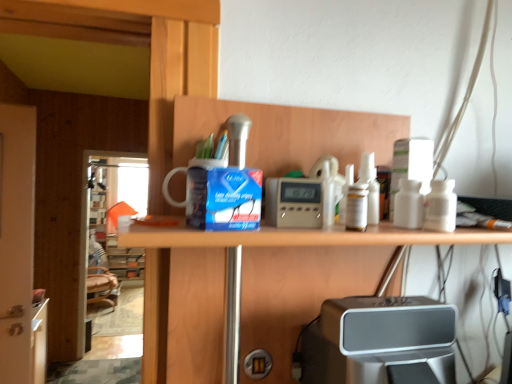
Question: In terms of size, does transparent glass screen door at left, marked as the second screen door in a front-to-back arrangement, appear bigger or smaller than matte digital clock at center?

Choices:
 (A) small
 (B) big

Answer: (B)

Question: Would you say transparent glass screen door at left, marked as the second screen door in a front-to-back arrangement, is inside or outside matte digital clock at center?

Choices:
 (A) outside
 (B) inside

Answer: (A)

Question: Based on their relative distances, which object is farther from the transparent glass screen door at left, the first screen door from the back?

Choices:
 (A) matte digital clock at center
 (B) silver metallic speaker at lower center
 (C) white glossy door at left, marked as the first screen door in a right-to-left arrangement

Answer: (A)

Question: Based on their relative distances, which object is farther from the transparent glass screen door at left, marked as the second screen door in a front-to-back arrangement?

Choices:
 (A) matte digital clock at center
 (B) silver metallic speaker at lower center
 (C) white glossy door at left, which is counted as the 1th screen door, starting from the front

Answer: (A)